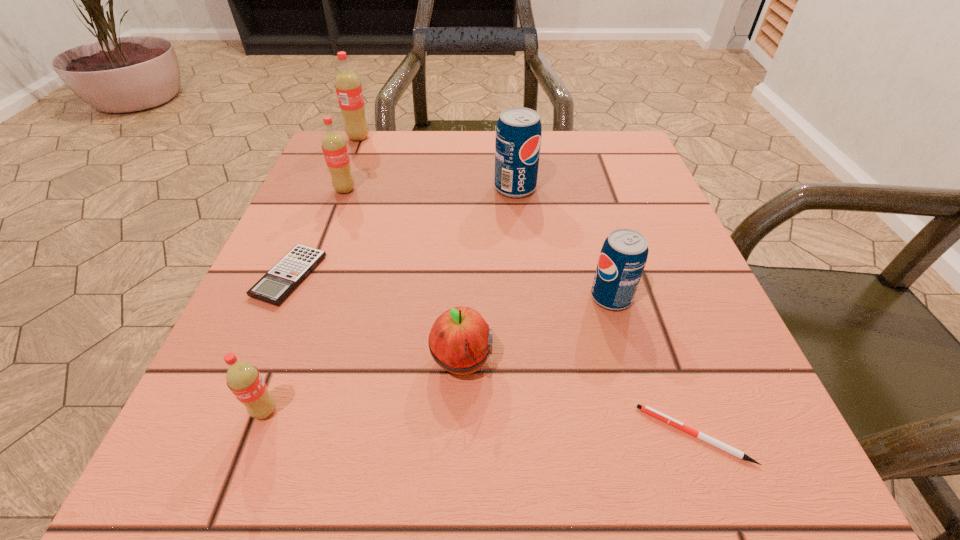
Find the location of `the farthest red soda`. the farthest red soda is located at coordinates (349, 92).

Locate an element on the screen. This screenshot has width=960, height=540. the farthest object is located at coordinates (349, 92).

Find the location of `the third object from right to left`. the third object from right to left is located at coordinates (518, 133).

Identify the location of the left blue pop. Image resolution: width=960 pixels, height=540 pixels. (518, 133).

Locate an element on the screen. Image resolution: width=960 pixels, height=540 pixels. the second smallest red soda is located at coordinates (334, 147).

Locate an element on the screen. This screenshot has height=540, width=960. the nearer blue pop is located at coordinates (623, 256).

Find the location of a particular element. Image resolution: width=960 pixels, height=540 pixels. the right blue pop is located at coordinates (623, 256).

This screenshot has width=960, height=540. I want to click on the nearest soda, so click(244, 380).

I want to click on the smallest red soda, so click(x=244, y=380).

This screenshot has width=960, height=540. I want to click on apple, so click(460, 341).